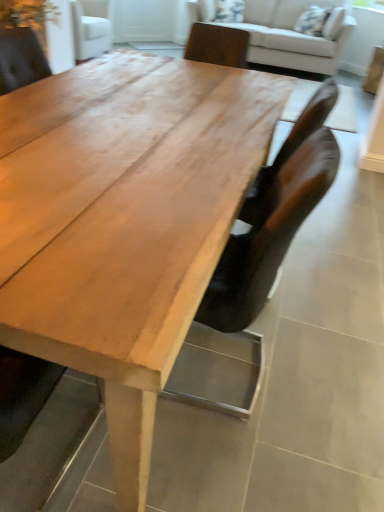
Question: From a real-world perspective, is light beige fabric couch at upper center physically located above or below brown leather chair at center?

Choices:
 (A) above
 (B) below

Answer: (A)

Question: From the image's perspective, is light beige fabric couch at upper center located above or below brown leather chair at center?

Choices:
 (A) above
 (B) below

Answer: (A)

Question: Estimate the real-world distances between objects in this image. Which object is farther from the brown leather chair at center?

Choices:
 (A) light beige fabric couch at upper center
 (B) light brown wood table at center

Answer: (A)

Question: Estimate the real-world distances between objects in this image. Which object is closer to the light beige fabric couch at upper center?

Choices:
 (A) light brown wood table at center
 (B) brown leather chair at center

Answer: (A)